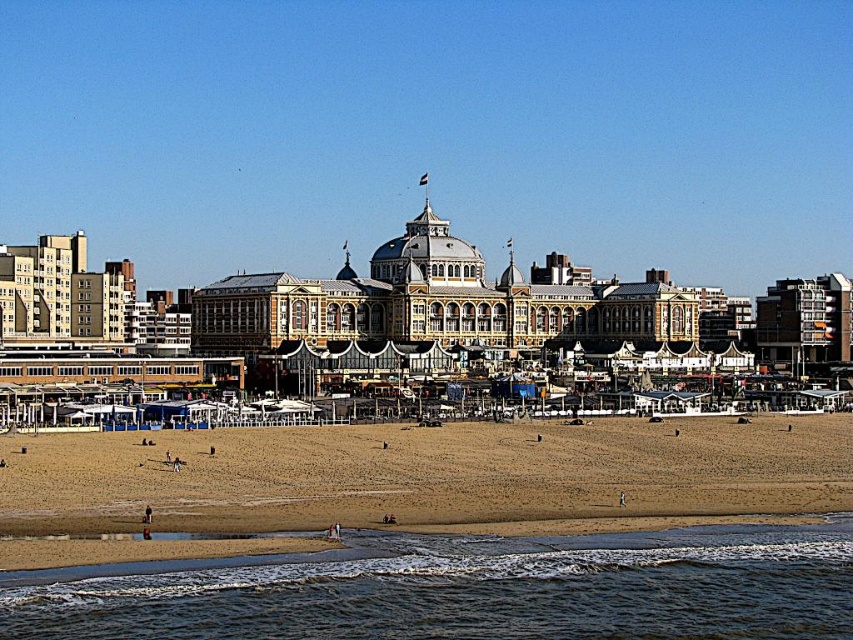
You are a lifeguard on duty and need to quickly assess the distance between the clear water at lower left and the brown sandy beach at lower center. Which one has a greater width from your vantage point?

The brown sandy beach at lower center has a greater width than the clear water at lower left, as the clear water at lower left is described as thinner.

You are standing on the brown sandy beach at lower center and want to reach the clear water at lower left. According to the scene description, which direction should you move to get to the water?

The clear water at lower left is located below the brown sandy beach at lower center, so you should move downward or towards the lower left direction from the brown sandy beach at lower center to reach the clear water at lower left.